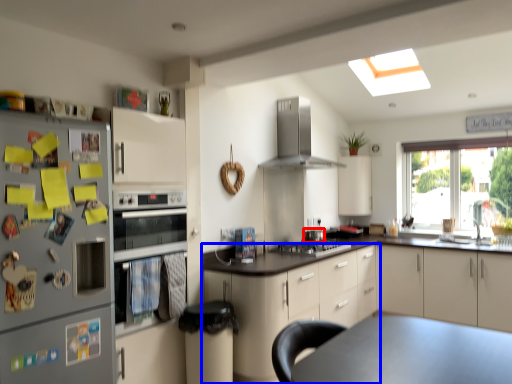
Question: Which object is further to the camera taking this photo, appliance (highlighted by a red box) or cabinetry (highlighted by a blue box)?

Choices:
 (A) appliance
 (B) cabinetry

Answer: (A)